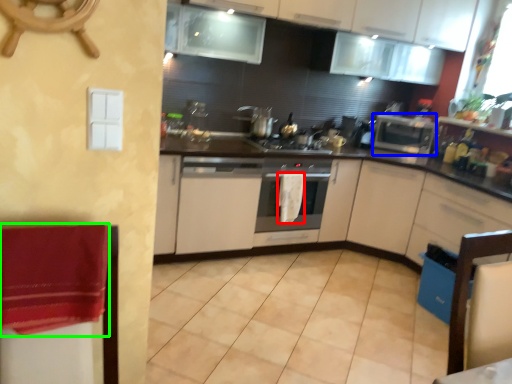
Question: Based on their relative distances, which object is farther from hand towel (highlighted by a red box)? Choose from appliance (highlighted by a blue box) and blanket (highlighted by a green box).

Choices:
 (A) appliance
 (B) blanket

Answer: (B)